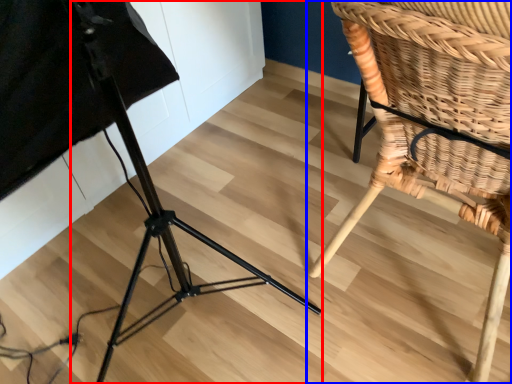
Question: Which object is closer to the camera taking this photo, tripod (highlighted by a red box) or chair (highlighted by a blue box)?

Choices:
 (A) tripod
 (B) chair

Answer: (A)